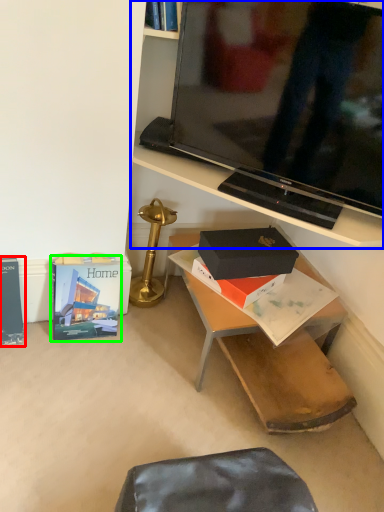
Question: Which object is the closest to the paperback book (highlighted by a red box)? Choose among these: shelf (highlighted by a blue box) or paperback book (highlighted by a green box).

Choices:
 (A) shelf
 (B) paperback book

Answer: (B)